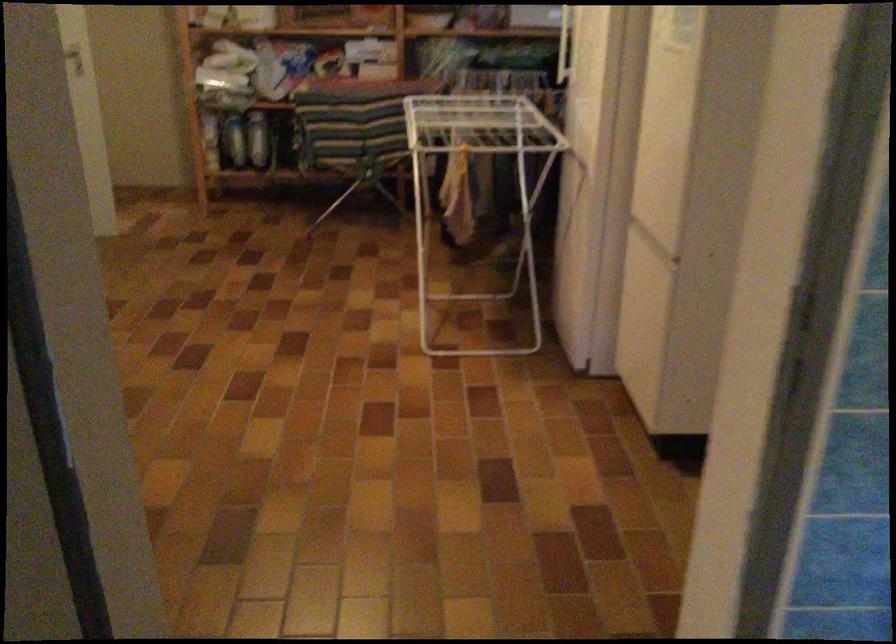
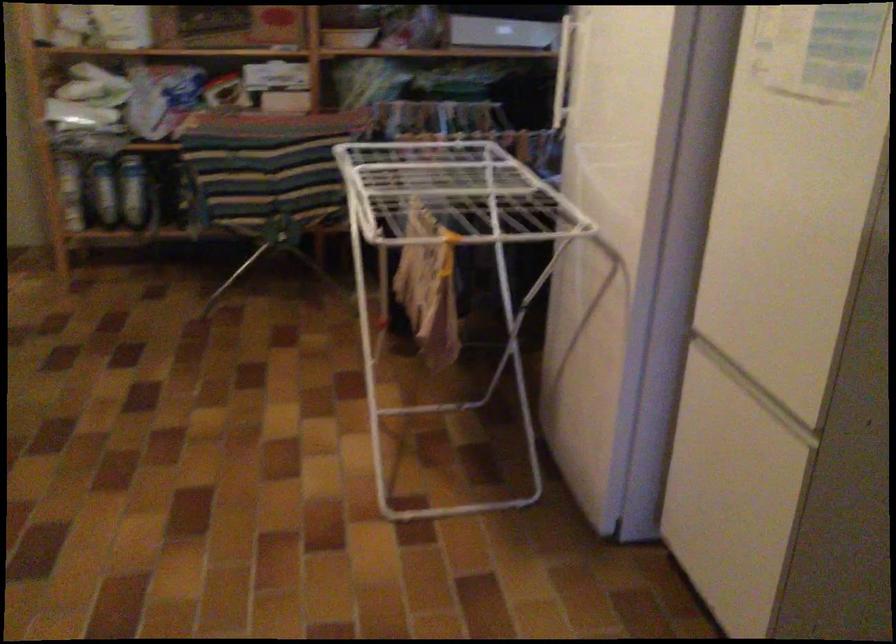
In the second image, find the point that corresponds to [250,138] in the first image.

(133, 191)